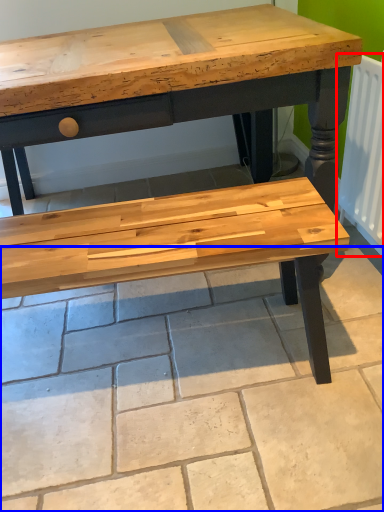
Question: Which object appears farthest to the camera in this image, radiator (highlighted by a red box) or tile (highlighted by a blue box)?

Choices:
 (A) radiator
 (B) tile

Answer: (A)